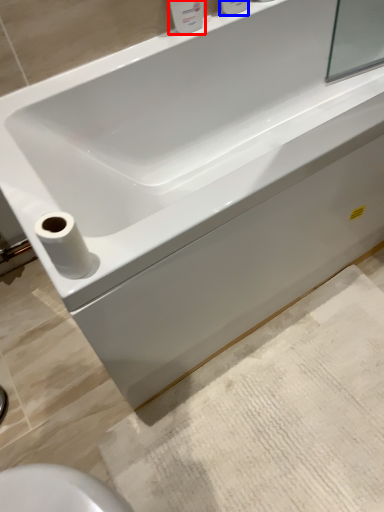
Question: Which object is closer to the camera taking this photo, toiletry (highlighted by a red box) or toiletry (highlighted by a blue box)?

Choices:
 (A) toiletry
 (B) toiletry

Answer: (A)